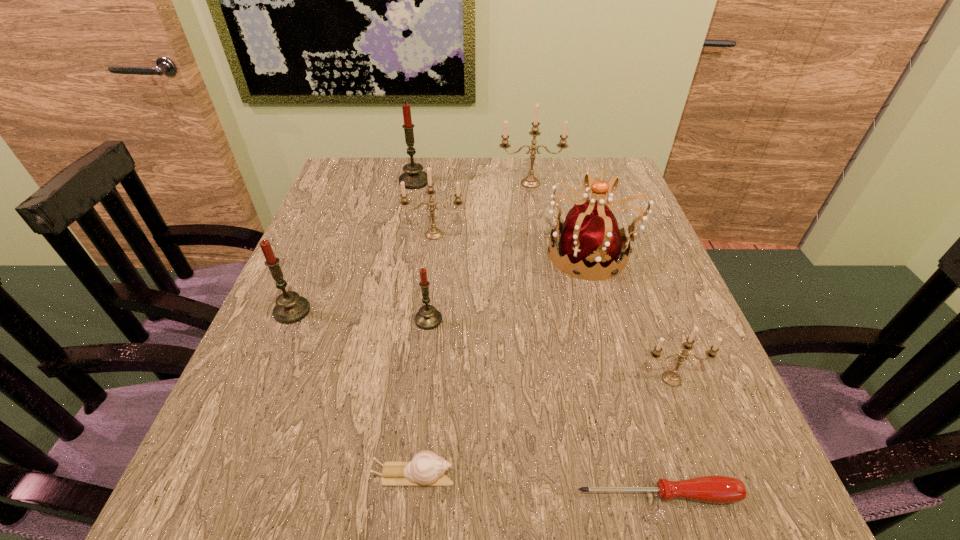
Where is `free space that satisfies the following two spatial constraints: 1. on the front side of the fifth candle from left to right; 2. on the shell of the escargot`? The image size is (960, 540). free space that satisfies the following two spatial constraints: 1. on the front side of the fifth candle from left to right; 2. on the shell of the escargot is located at coordinates (577, 476).

This screenshot has width=960, height=540. Find the location of `free spot that satisfies the following two spatial constraints: 1. on the front side of the red screwdriver; 2. on the left side of the second smallest metallic candle`. free spot that satisfies the following two spatial constraints: 1. on the front side of the red screwdriver; 2. on the left side of the second smallest metallic candle is located at coordinates (402, 495).